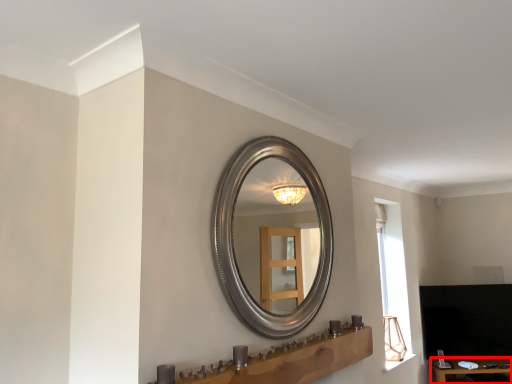
Question: Observing the image, what is the correct spatial positioning of table (annotated by the red box) in reference to vanity?

Choices:
 (A) left
 (B) right

Answer: (B)